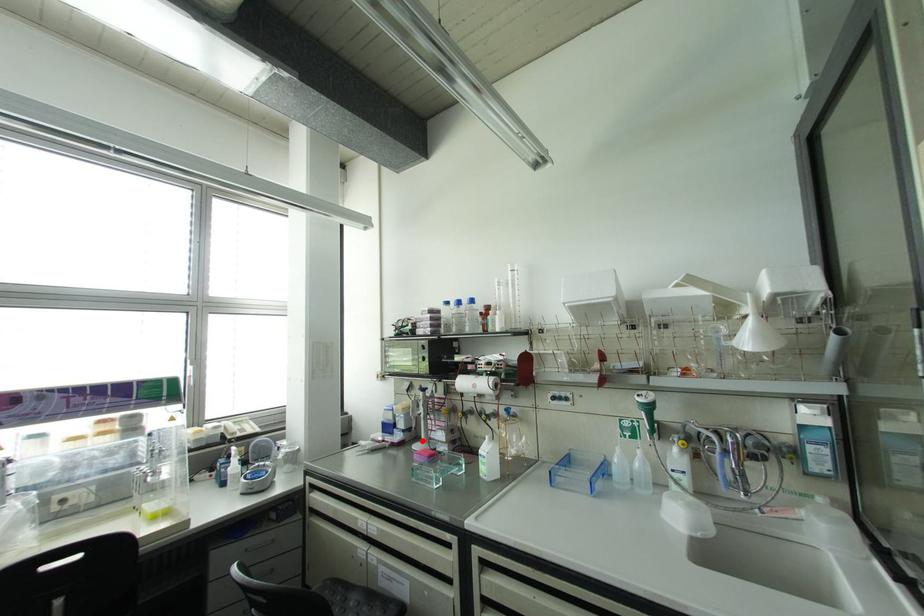
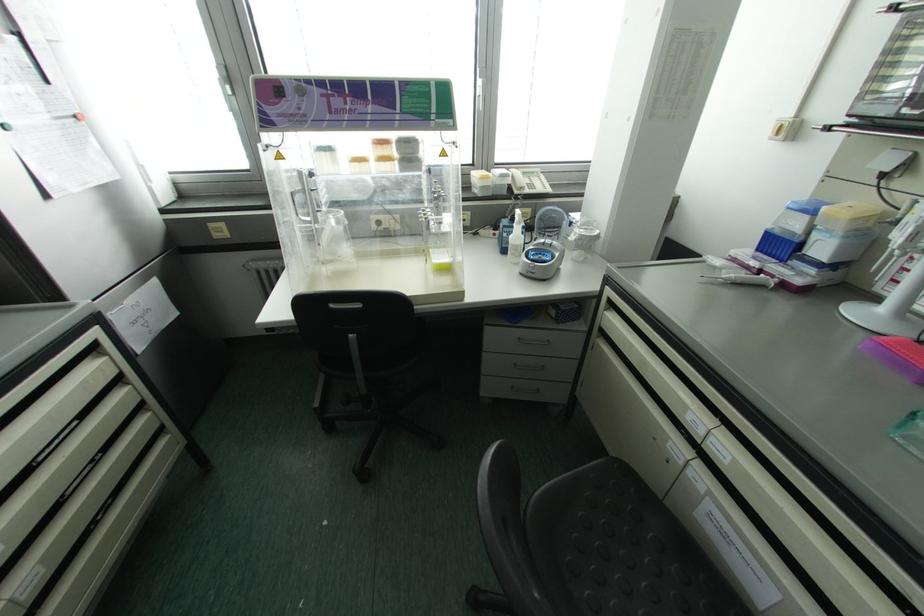
Locate, in the second image, the point that corresponds to the highlighted location in the first image.

(881, 309)